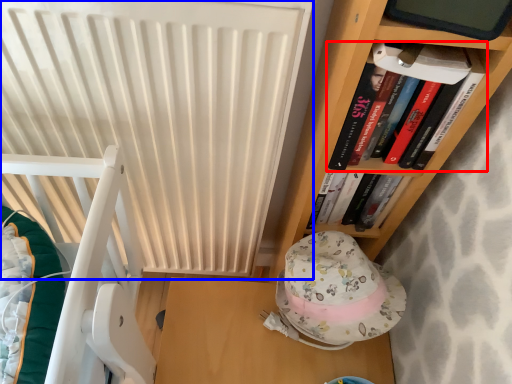
Question: Which of the following is the closest to the observer, book (highlighted by a red box) or radiator (highlighted by a blue box)?

Choices:
 (A) book
 (B) radiator

Answer: (B)